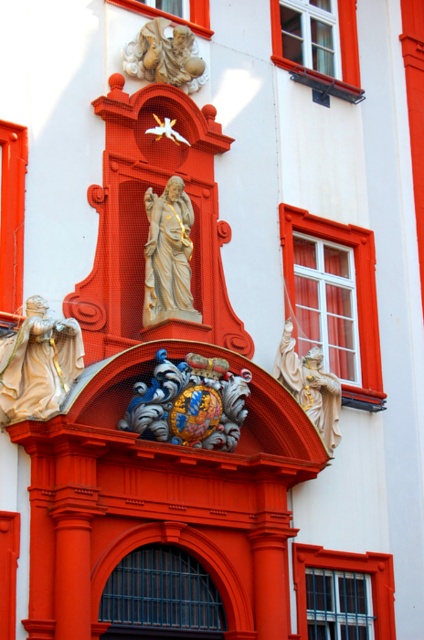
You are standing at the base of the archway and want to take a photo of the carved stone cherub at upper center using a camera. The camera is 182.93 feet away from the cherub. Is this distance within the camera lens range of 200 feet?

The carved stone cherub at upper center and camera are 182.93 feet apart, so yes, the distance is within the camera lens range of 200 feet.

You are an architect examining a building design. You notice two points marked in the image. The first point is at coordinate point[70,378] and the second is at point[145,204]. Based on the scene description, which point is positioned closer to the viewer?

Point[70,378] is closer to the viewer than point[145,204] according to the description.